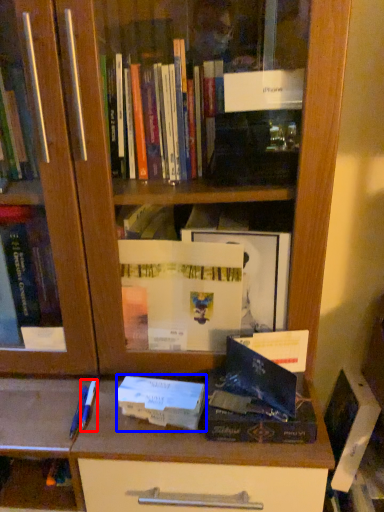
Question: Which point is further to the camera, pen (highlighted by a red box) or paperback book (highlighted by a blue box)?

Choices:
 (A) pen
 (B) paperback book

Answer: (A)